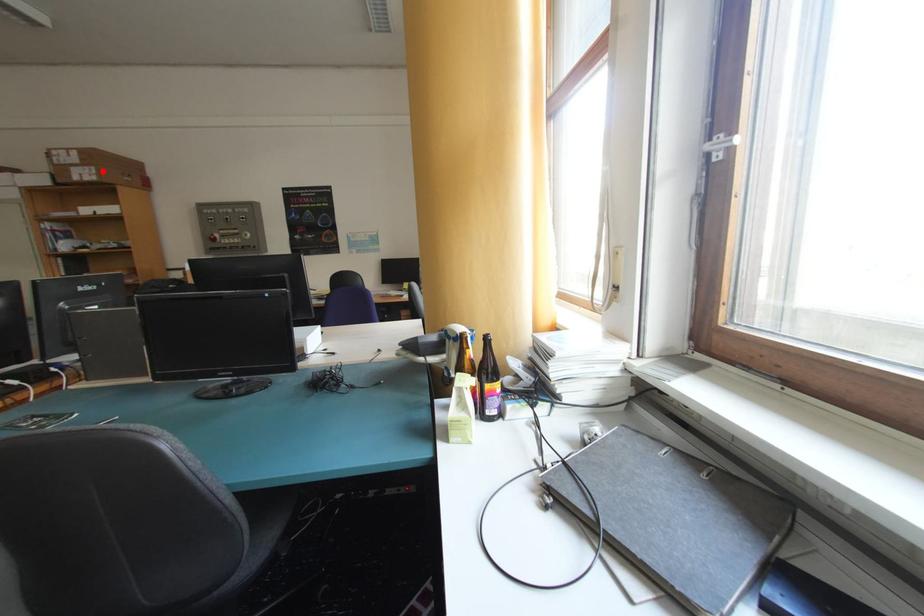
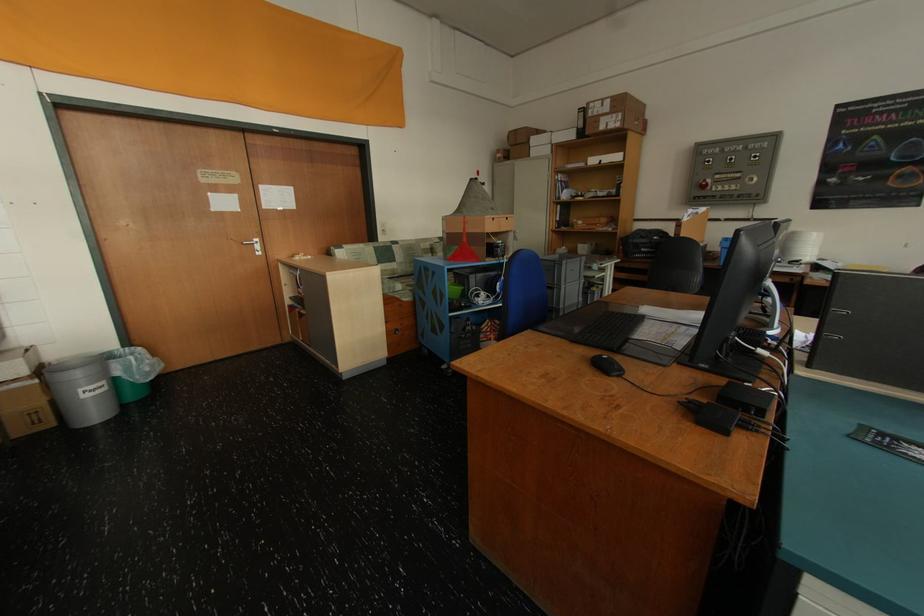
Question: A red point is marked in image1. In image2, is the corresponding 3D point closer to the camera or farther? Reply with the corresponding letter.

Choices:
 (A) The corresponding 3D point is closer.
 (B) The corresponding 3D point is farther.

Answer: (A)